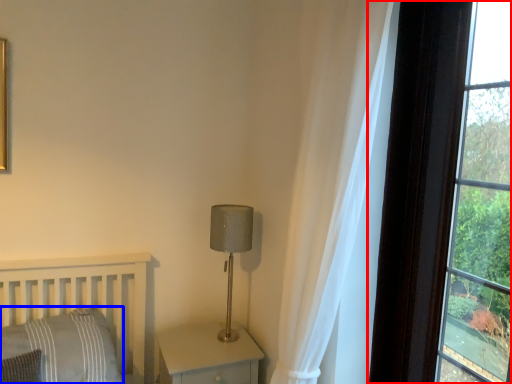
Question: Which object appears closest to the camera in this image, window (highlighted by a red box) or pillow (highlighted by a blue box)?

Choices:
 (A) window
 (B) pillow

Answer: (A)